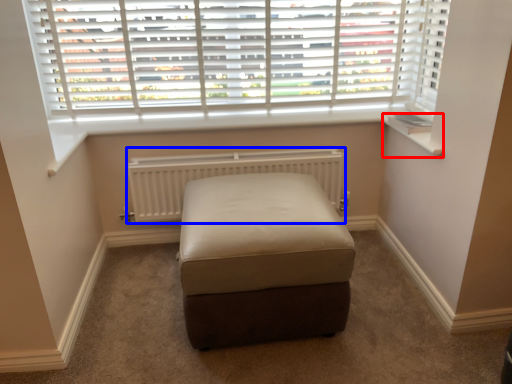
Question: Which point is further to the camera, window sill (highlighted by a red box) or radiator (highlighted by a blue box)?

Choices:
 (A) window sill
 (B) radiator

Answer: (B)